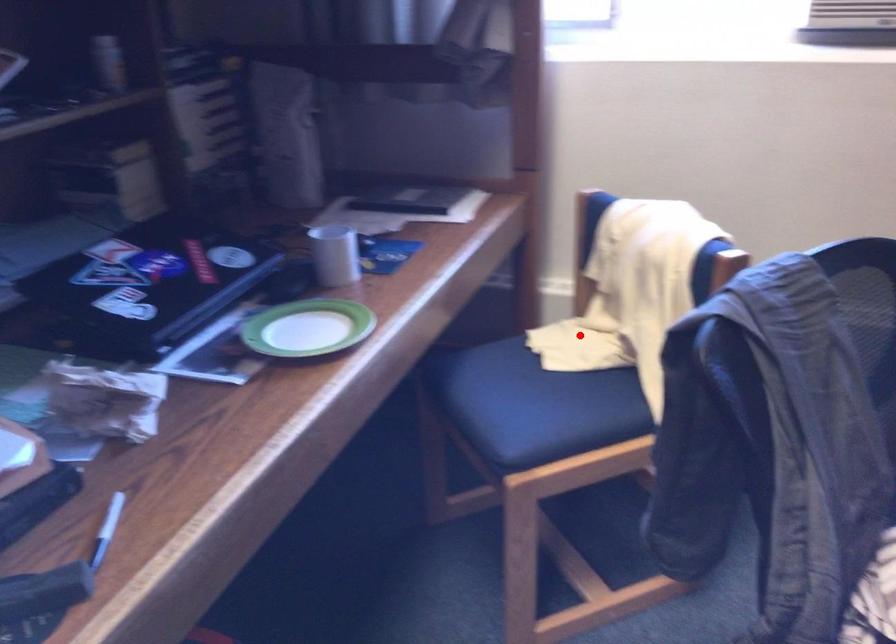
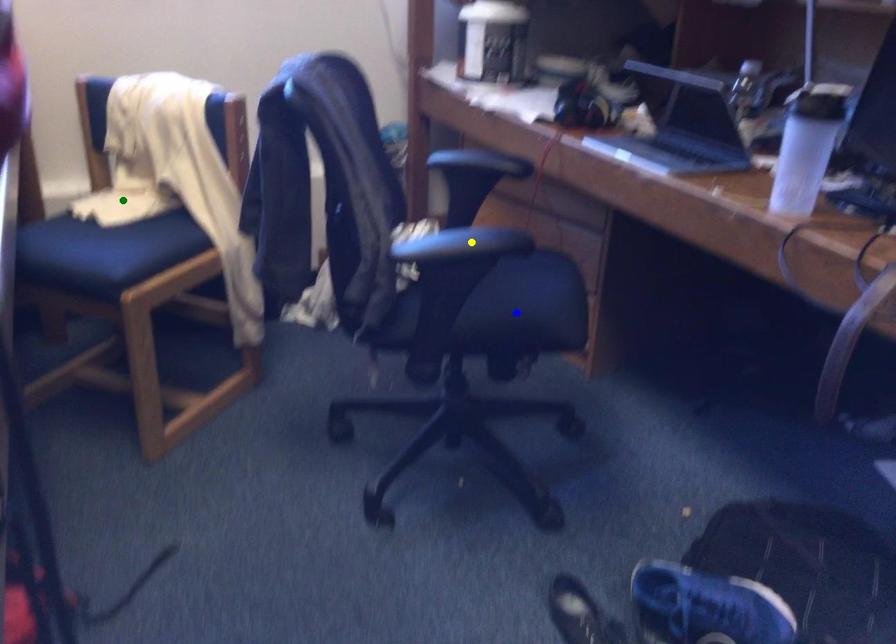
Question: I am providing you with two images of the same scene from different viewpoints. A red point is marked on the first image. You are given multiple points on the second image. Which point in image 2 represents the same 3d spot as the red point in image 1?

Choices:
 (A) green point
 (B) blue point
 (C) yellow point

Answer: (A)